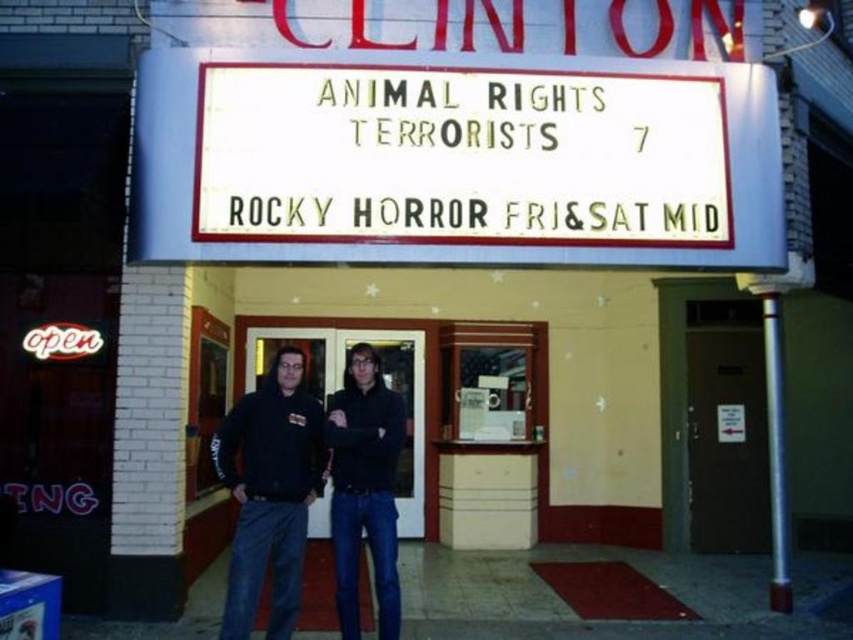
Question: Is black hoodie at center wider than black matte hoodie at center?

Choices:
 (A) no
 (B) yes

Answer: (B)

Question: Where is black hoodie at center located in relation to black matte hoodie at center in the image?

Choices:
 (A) left
 (B) right

Answer: (A)

Question: Which point is farther to the camera?

Choices:
 (A) black hoodie at center
 (B) black matte hoodie at center

Answer: (B)

Question: Does black hoodie at center have a larger size compared to black matte hoodie at center?

Choices:
 (A) yes
 (B) no

Answer: (A)